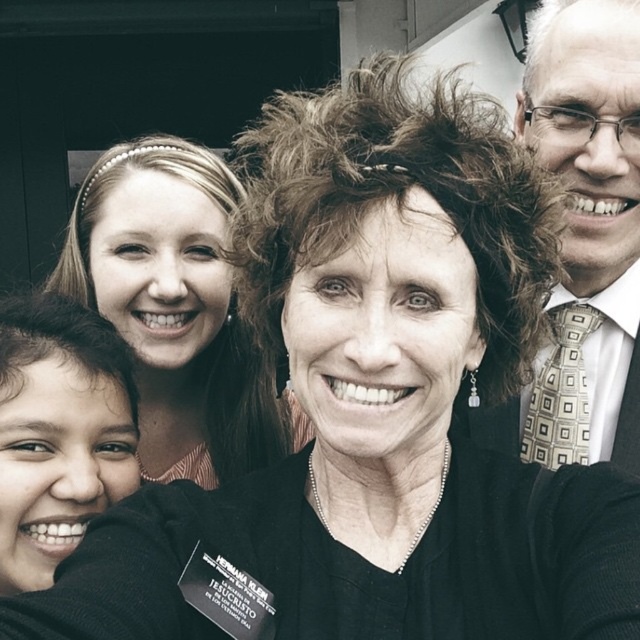
Is matte black hair at center in front of gold-patterned tie at right?

No, it is not.

Does matte black hair at center have a greater width compared to gold-patterned tie at right?

Correct, the width of matte black hair at center exceeds that of gold-patterned tie at right.

Image resolution: width=640 pixels, height=640 pixels. In order to click on matte black hair at center in this screenshot , I will do `click(177, 308)`.

Is point (157, 300) positioned after point (67, 392)?

Yes, it is.

You are a GUI agent. You are given a task and a screenshot of the screen. Output one action in this format:
    pyautogui.click(x=<x>, y=<y>)
    Task: Click on the matte black hair at center
    The height and width of the screenshot is (640, 640).
    Given the screenshot: What is the action you would take?
    pyautogui.click(x=177, y=308)

Find the location of `matte black hair at center`. matte black hair at center is located at coordinates (177, 308).

Can you confirm if smooth skin face at lower left is bigger than gold-patterned tie at right?

Yes.

Is smooth skin face at lower left below gold-patterned tie at right?

Indeed, smooth skin face at lower left is positioned under gold-patterned tie at right.

Describe the element at coordinates (58, 432) in the screenshot. This screenshot has width=640, height=640. I see `smooth skin face at lower left` at that location.

The width and height of the screenshot is (640, 640). In order to click on smooth skin face at lower left in this screenshot , I will do `click(58, 432)`.